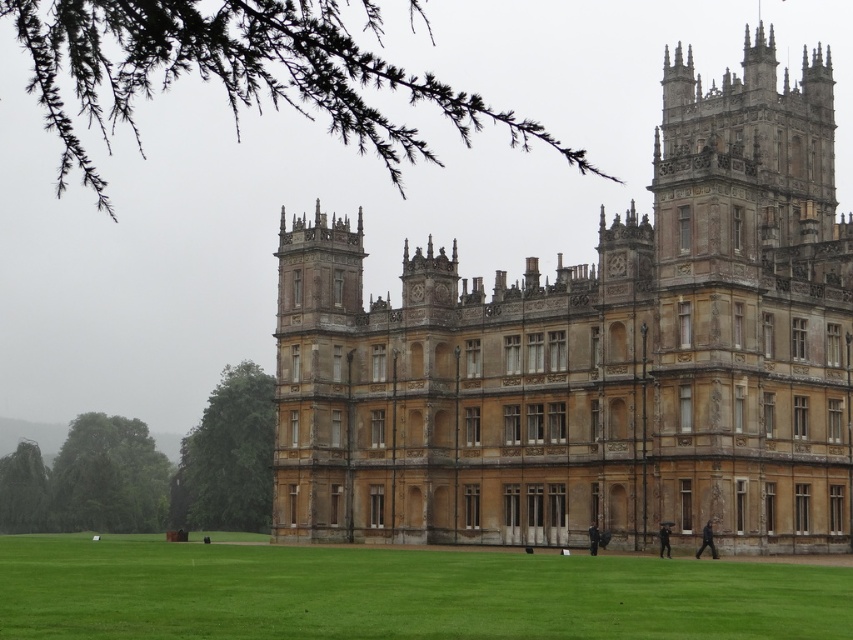
Question: Does golden stone castle at center appear on the left side of dark gray suit at lower right?

Choices:
 (A) yes
 (B) no

Answer: (A)

Question: Which of the following is the closest to the observer?

Choices:
 (A) (589, 547)
 (B) (706, 538)
 (C) (230, 625)

Answer: (C)

Question: Does dark gray fabric coat at lower right have a larger size compared to dark blue fabric coat at lower center?

Choices:
 (A) yes
 (B) no

Answer: (A)

Question: Which object appears closest to the camera in this image?

Choices:
 (A) green grass at lower center
 (B) dark gray fabric coat at lower right
 (C) dark gray suit at lower right

Answer: (A)

Question: In this image, where is golden stone castle at center located relative to dark gray suit at lower right?

Choices:
 (A) right
 (B) left

Answer: (B)

Question: Which object appears farthest from the camera in this image?

Choices:
 (A) dark blue fabric coat at lower center
 (B) golden stone castle at center
 (C) dark gray suit at lower right

Answer: (A)